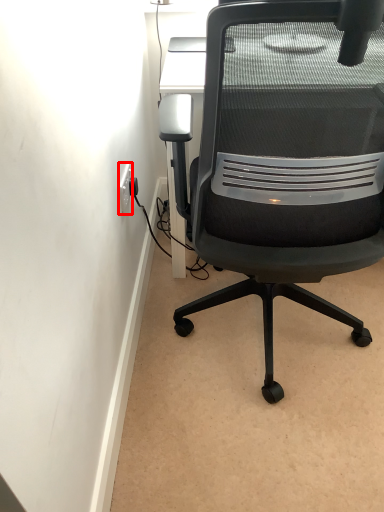
Question: From the image's perspective, considering the relative positions of electric outlet (annotated by the red box) and chair in the image provided, where is electric outlet (annotated by the red box) located with respect to the staircase?

Choices:
 (A) above
 (B) below

Answer: (A)